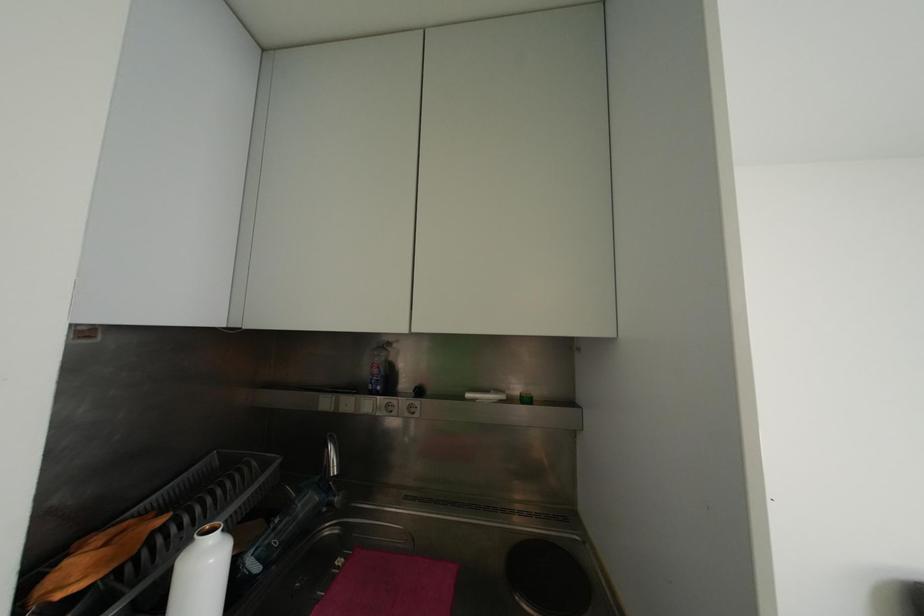
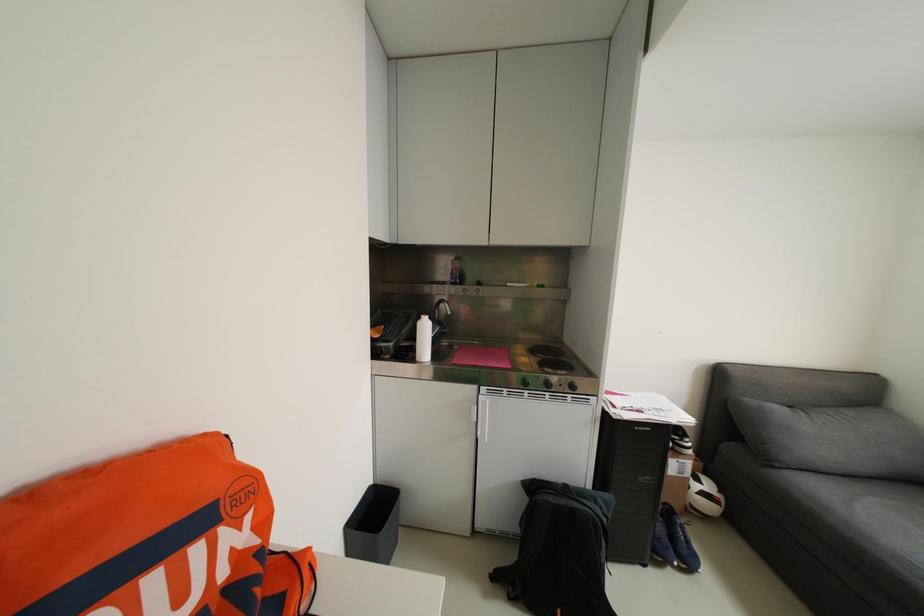
In a continuous first-person perspective shot, in which direction is the camera moving?

The cameraman walked toward left, backward.